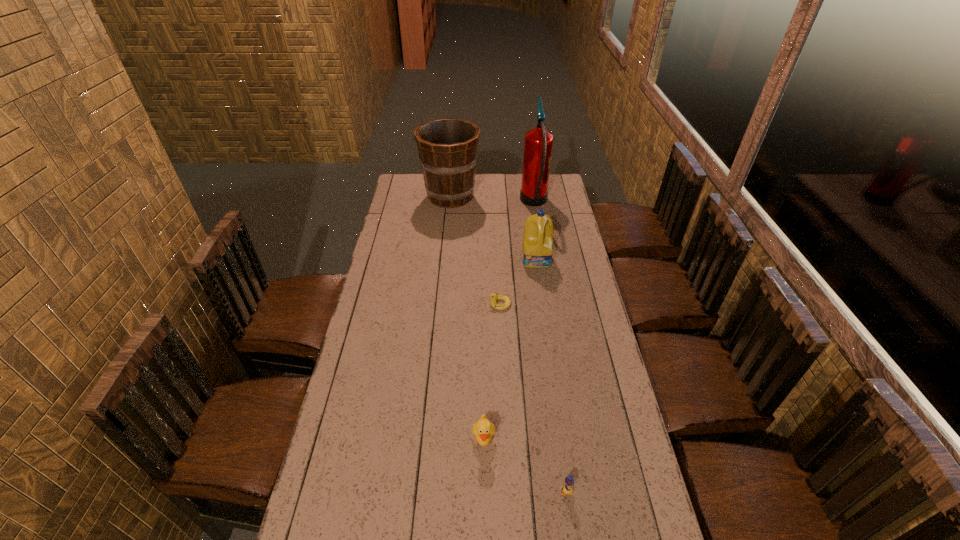
The height and width of the screenshot is (540, 960). What are the coordinates of `duckling that is the third closest to the second tallest object` in the screenshot? It's located at (567, 489).

Locate an element on the screen. This screenshot has height=540, width=960. vacant region that satisfies the following two spatial constraints: 1. on the label of the detergent; 2. on the face of the shortest duckling is located at coordinates (543, 303).